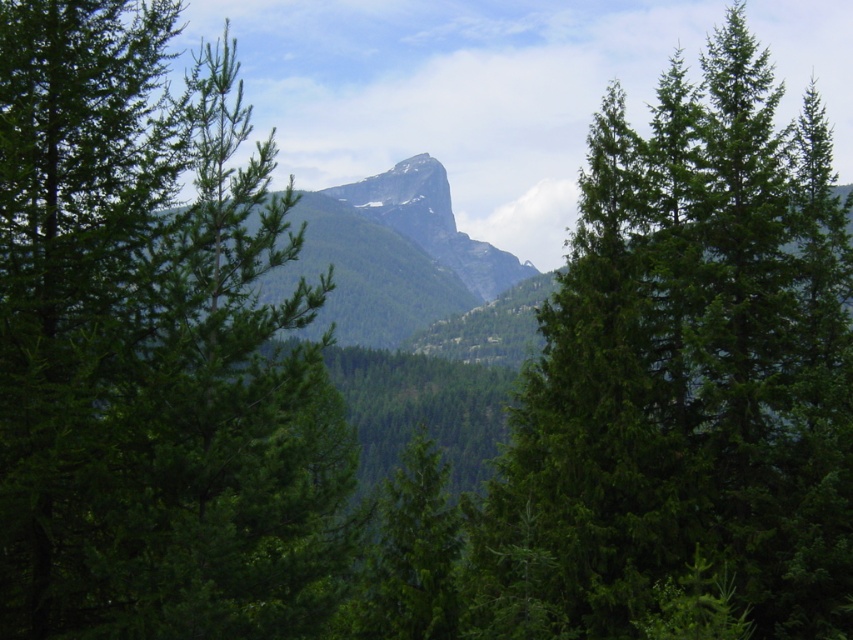
Question: Is green needle-like tree at center to the left of green textured mountain at center from the viewer's perspective?

Choices:
 (A) no
 (B) yes

Answer: (B)

Question: Which of these objects is positioned farthest from the green needle-like tree at center?

Choices:
 (A) green textured mountain at center
 (B) green matte tree at center

Answer: (A)

Question: Is green matte tree at center thinner than green textured mountain at center?

Choices:
 (A) yes
 (B) no

Answer: (A)

Question: Which point is farther to the camera?

Choices:
 (A) green needle-like tree at center
 (B) green matte tree at center
 (C) green textured mountain at center

Answer: (C)

Question: Does green needle-like tree at center appear on the right side of green textured mountain at center?

Choices:
 (A) yes
 (B) no

Answer: (B)

Question: Which object appears closest to the camera in this image?

Choices:
 (A) green textured mountain at center
 (B) green needle-like tree at center
 (C) green matte tree at center

Answer: (B)